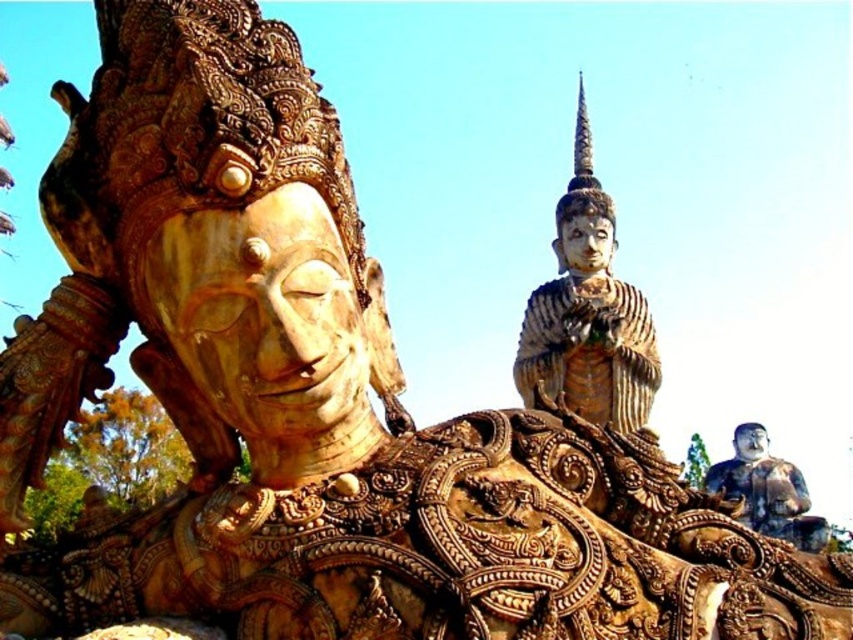
Question: Where is gold textured statue at center located in relation to polished bronze statue at lower right in the image?

Choices:
 (A) right
 (B) left

Answer: (B)

Question: Considering the relative positions of gold textured statue at center and polished bronze statue at lower right in the image provided, where is gold textured statue at center located with respect to polished bronze statue at lower right?

Choices:
 (A) below
 (B) above

Answer: (B)

Question: Among these objects, which one is farthest from the camera?

Choices:
 (A) polished bronze statue at lower right
 (B) gold textured statue at center

Answer: (B)

Question: Which object is closer to the camera taking this photo?

Choices:
 (A) polished bronze statue at lower right
 (B) gold textured statue at center

Answer: (A)

Question: Does gold textured statue at center appear under polished bronze statue at lower right?

Choices:
 (A) yes
 (B) no

Answer: (B)